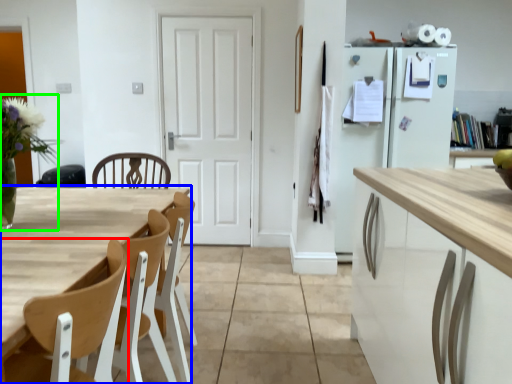
Question: Which object is the farthest from chair (highlighted by a red box)? Choose among these: table (highlighted by a blue box) or floral arrangement (highlighted by a green box).

Choices:
 (A) table
 (B) floral arrangement

Answer: (B)